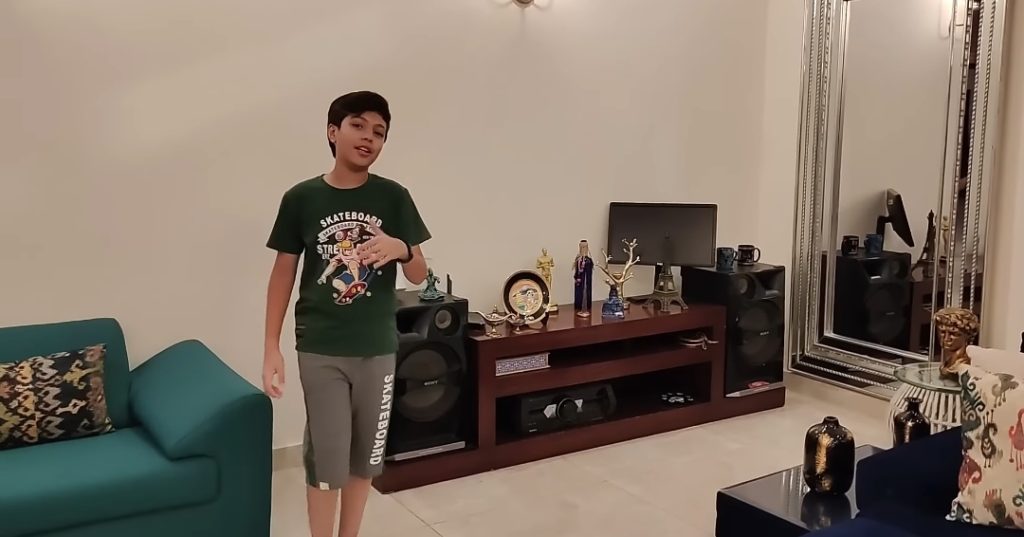
This screenshot has width=1024, height=537. What are the coordinates of `stereo` in the screenshot? It's located at (413, 396).